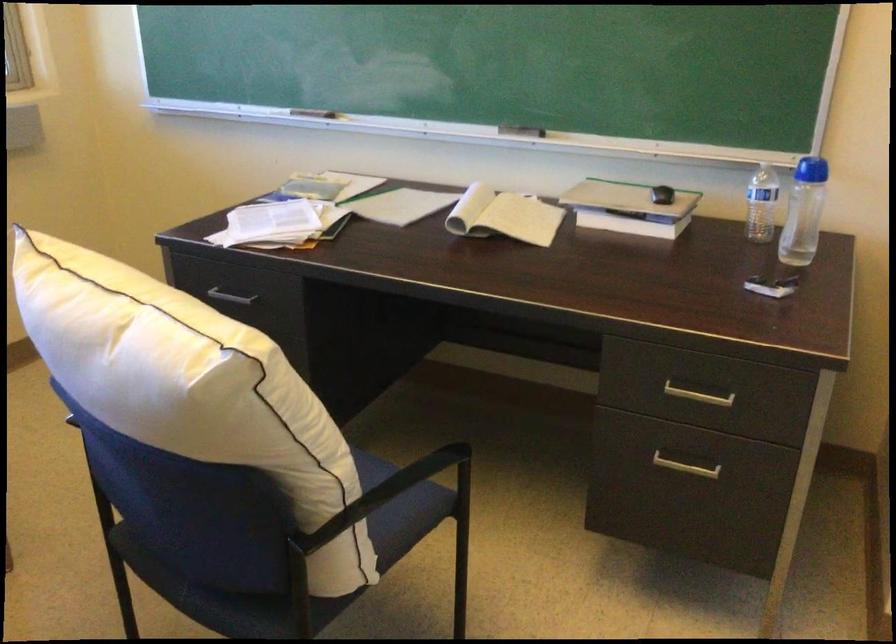
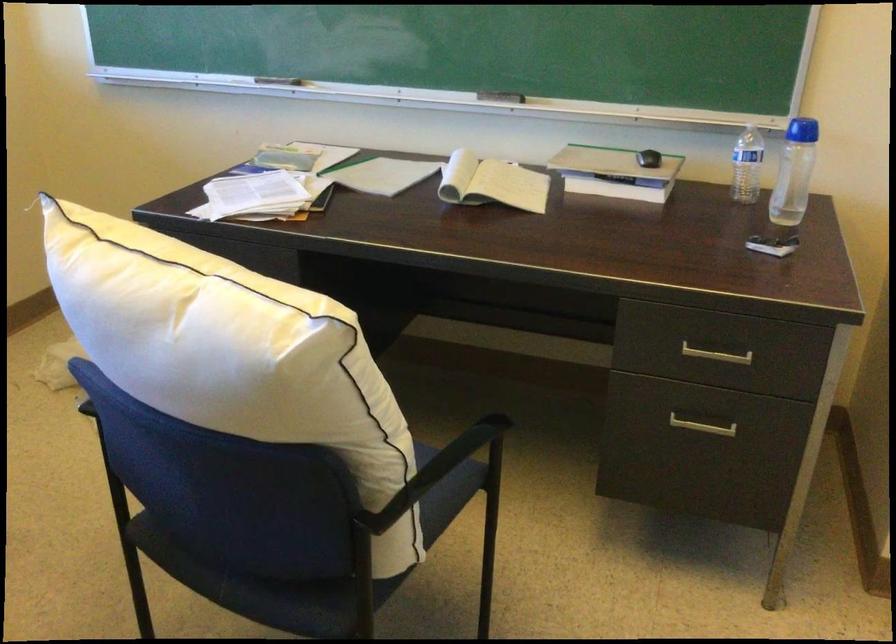
Where in the second image is the point corresponding to point (683, 468) from the first image?

(702, 426)